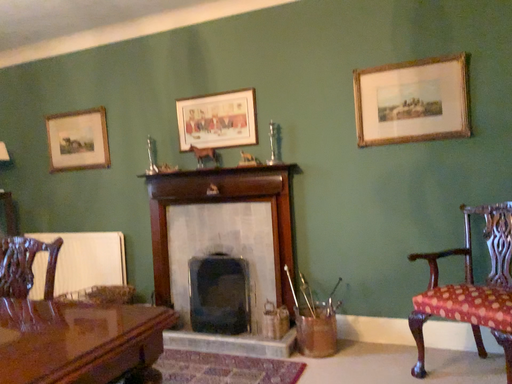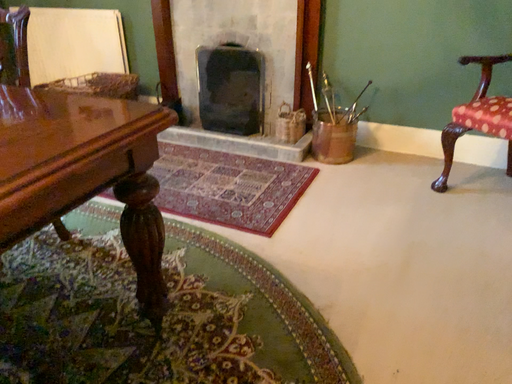
Question: Which way did the camera rotate in the video?

Choices:
 (A) rotated upward
 (B) rotated downward

Answer: (B)